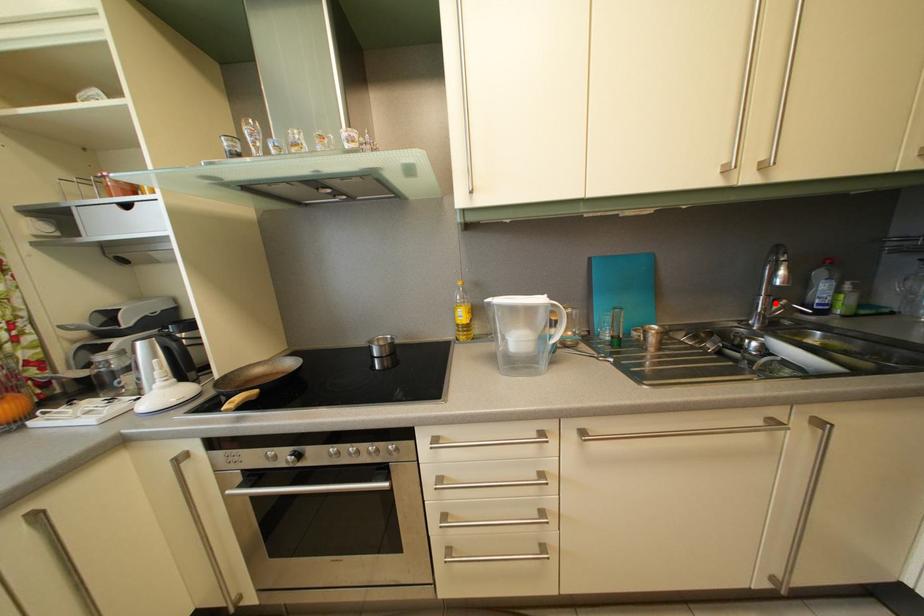
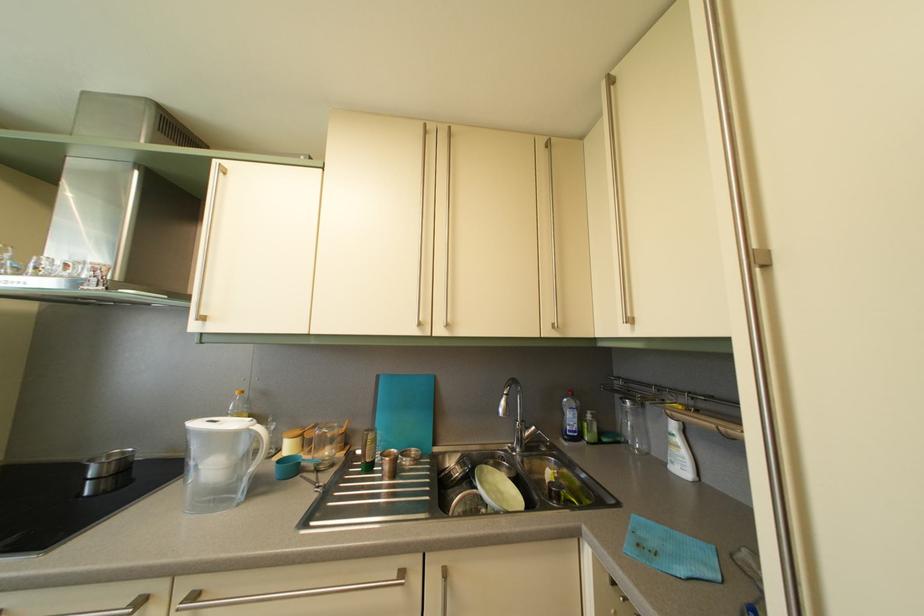
Question: I am providing you with two images of the same scene from different viewpoints. In image1, a red point is highlighted. Considering the same 3D point in image2, which of the following is correct?

Choices:
 (A) It is closer
 (B) It is farther

Answer: (B)